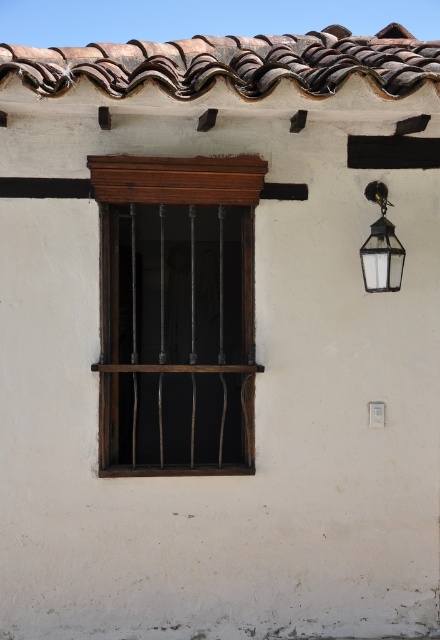
Which is more to the left, brown textured tiles at upper center or matte glass lantern at upper right?

From the viewer's perspective, brown textured tiles at upper center appears more on the left side.

Which is behind, point (18, 51) or point (398, 269)?

The point (18, 51) is behind.

I want to click on brown textured tiles at upper center, so click(x=233, y=61).

Between dark wood window frame at center and matte glass lantern at upper right, which one has less height?

With less height is matte glass lantern at upper right.

What do you see at coordinates (176, 314) in the screenshot? This screenshot has width=440, height=640. I see `dark wood window frame at center` at bounding box center [176, 314].

What do you see at coordinates (176, 314) in the screenshot? I see `dark wood window frame at center` at bounding box center [176, 314].

Image resolution: width=440 pixels, height=640 pixels. I want to click on dark wood window frame at center, so click(x=176, y=314).

Which of these two, dark wood window frame at center or brown textured tiles at upper center, stands taller?

With more height is dark wood window frame at center.

Is dark wood window frame at center above brown textured tiles at upper center?

No, dark wood window frame at center is not above brown textured tiles at upper center.

Locate an element on the screen. This screenshot has height=640, width=440. dark wood window frame at center is located at coordinates (176, 314).